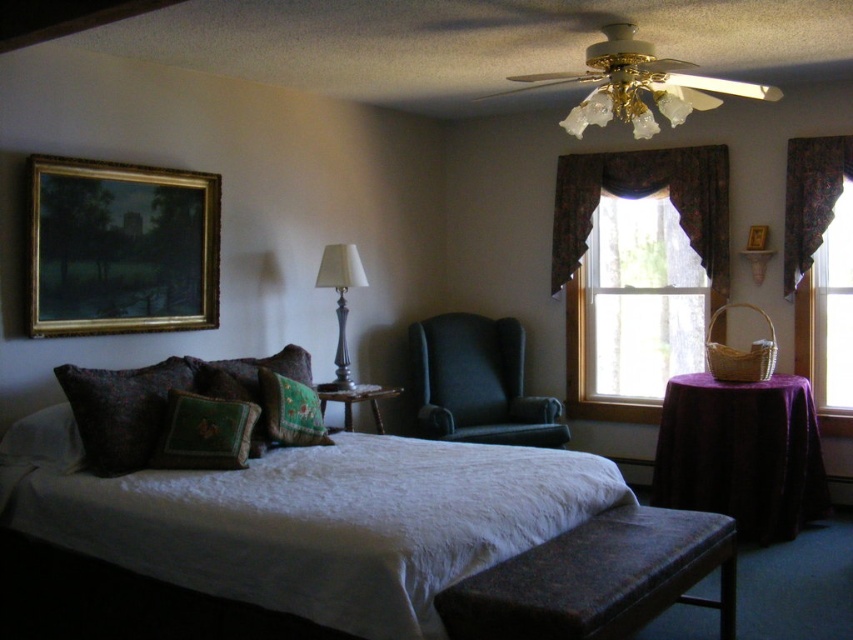
Based on the photo, you are standing in the bedroom and want to place a small vase on the bench. The point where you want to place it is at coordinates point (598, 579). Is this point located on the bench?

Yes, the point (598, 579) is located on the velvet dark brown bench at lower center, so placing the vase there is possible.